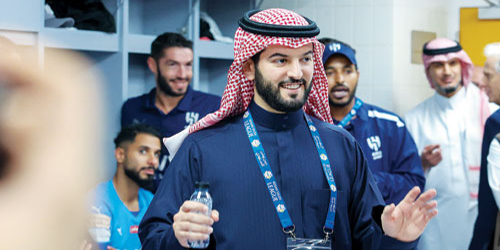
At what (x,y) coordinates should I click in order to perform the action: click on door's self-closing mechanism. Please return your answer as a coordinate pair (x, y). The image size is (500, 250). Looking at the image, I should click on pyautogui.click(x=492, y=11).